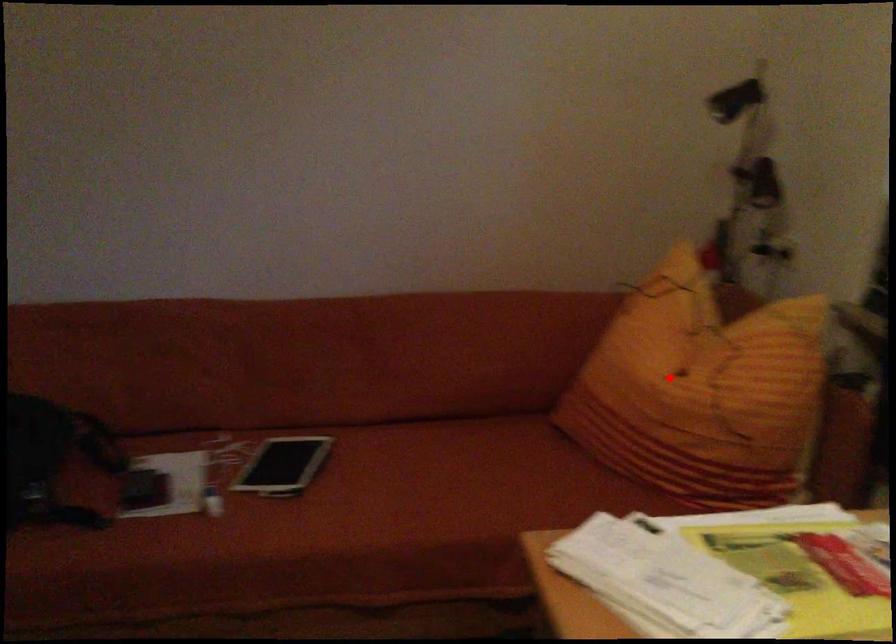
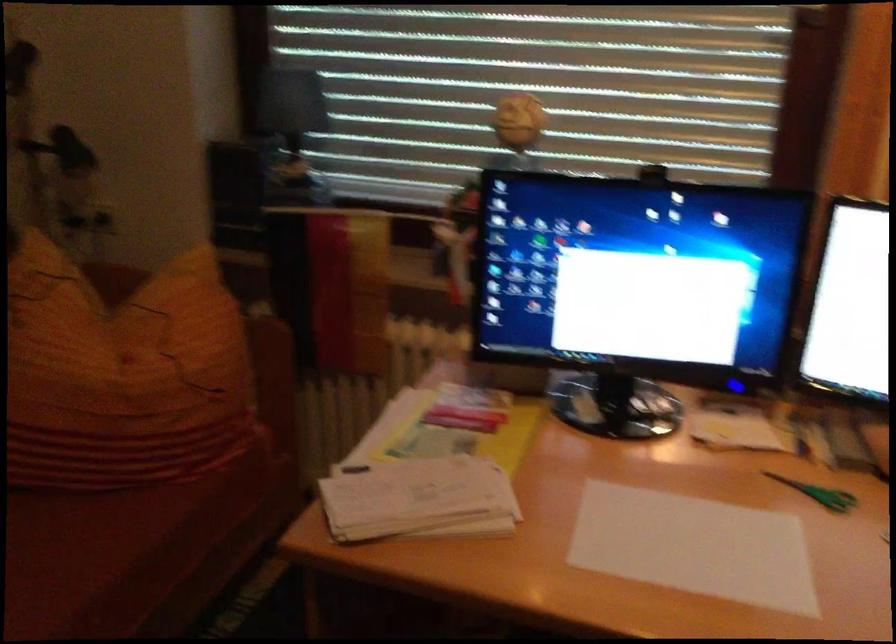
Find the pixel in the second image that matches the highlighted location in the first image.

(122, 374)